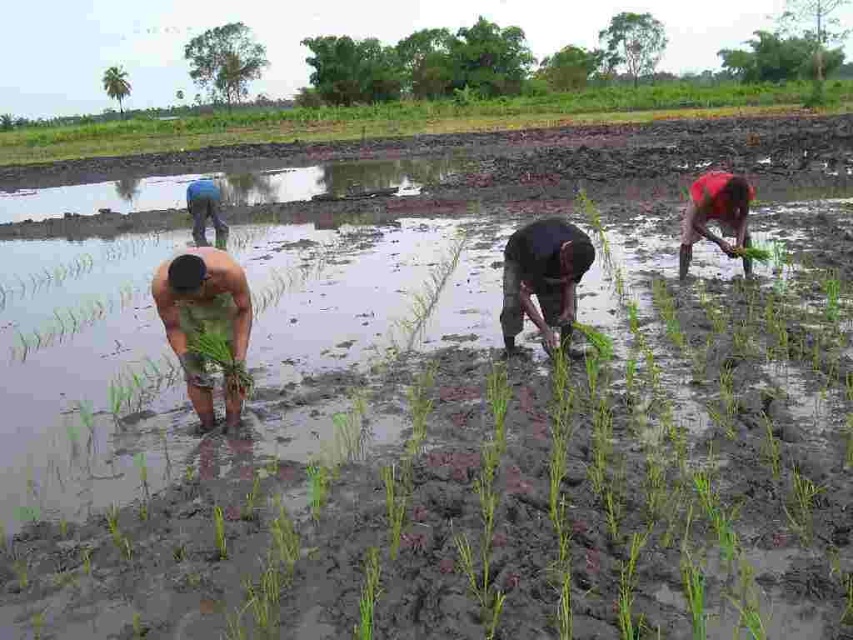
Question: Which of the following is the closest to the observer?

Choices:
 (A) (569, 276)
 (B) (177, 342)
 (C) (222, 362)

Answer: (C)

Question: Does dark brown skin at center appear on the right side of green leafy plant at lower left?

Choices:
 (A) yes
 (B) no

Answer: (A)

Question: Which of the following is the farthest from the observer?

Choices:
 (A) (202, 204)
 (B) (160, 316)
 (C) (225, 356)
 (D) (550, 296)

Answer: (A)

Question: Does green leafy plant at center appear on the right side of green leafy plant at lower left?

Choices:
 (A) no
 (B) yes

Answer: (A)

Question: Which object is positioned farthest from the dark brown skin at center?

Choices:
 (A) blue fabric shirt at upper left
 (B) red matte shirt at right
 (C) green leafy plant at lower left
 (D) green leafy plant at center

Answer: (A)

Question: Can you confirm if green leafy plant at center is smaller than blue fabric shirt at upper left?

Choices:
 (A) no
 (B) yes

Answer: (B)